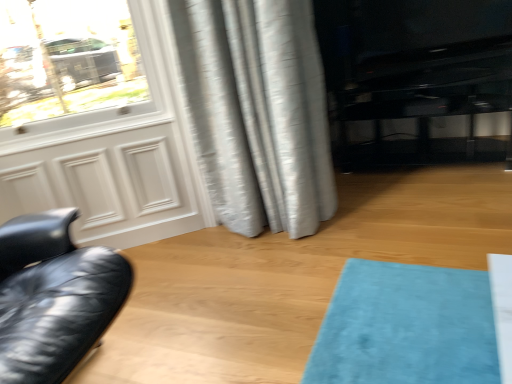
Question: Does black glossy entertainment center at right have a greater height compared to silvery textured curtain at center?

Choices:
 (A) no
 (B) yes

Answer: (A)

Question: Does black glossy entertainment center at right appear on the left side of silvery textured curtain at center?

Choices:
 (A) no
 (B) yes

Answer: (A)

Question: Does black glossy entertainment center at right have a larger size compared to silvery textured curtain at center?

Choices:
 (A) no
 (B) yes

Answer: (A)

Question: Does black glossy entertainment center at right lie behind silvery textured curtain at center?

Choices:
 (A) no
 (B) yes

Answer: (B)

Question: Can you confirm if black glossy entertainment center at right is wider than silvery textured curtain at center?

Choices:
 (A) yes
 (B) no

Answer: (A)

Question: Is black glossy entertainment center at right turned away from silvery textured curtain at center?

Choices:
 (A) yes
 (B) no

Answer: (B)

Question: Is silvery textured curtain at center not within black glossy entertainment center at right?

Choices:
 (A) no
 (B) yes

Answer: (B)

Question: Does silvery textured curtain at center appear on the right side of black glossy entertainment center at right?

Choices:
 (A) yes
 (B) no

Answer: (B)

Question: Is silvery textured curtain at center not near black glossy entertainment center at right?

Choices:
 (A) no
 (B) yes

Answer: (A)

Question: Is silvery textured curtain at center shorter than black glossy entertainment center at right?

Choices:
 (A) yes
 (B) no

Answer: (B)

Question: Is silvery textured curtain at center thinner than black glossy entertainment center at right?

Choices:
 (A) no
 (B) yes

Answer: (B)

Question: From a real-world perspective, does silvery textured curtain at center stand above black glossy entertainment center at right?

Choices:
 (A) yes
 (B) no

Answer: (A)

Question: From a real-world perspective, is matte white screen door at left positioned under black glossy entertainment center at right based on gravity?

Choices:
 (A) yes
 (B) no

Answer: (B)